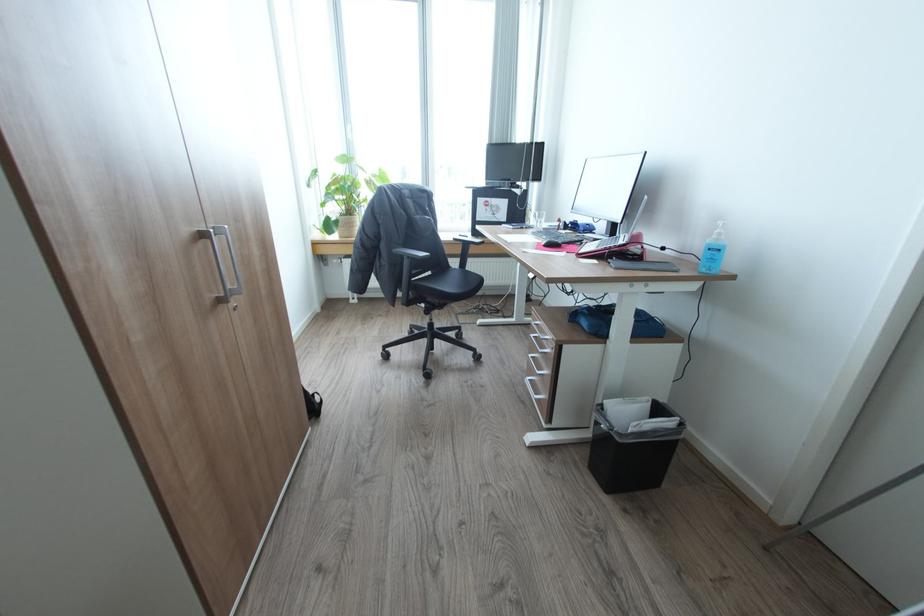
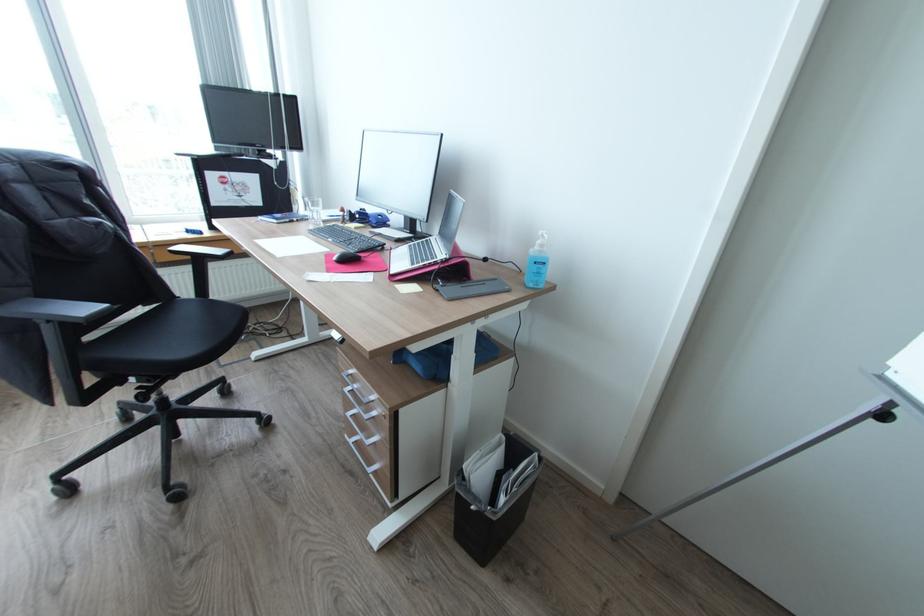
In the second image, find the point that corresponds to (471,270) in the first image.

(217, 300)